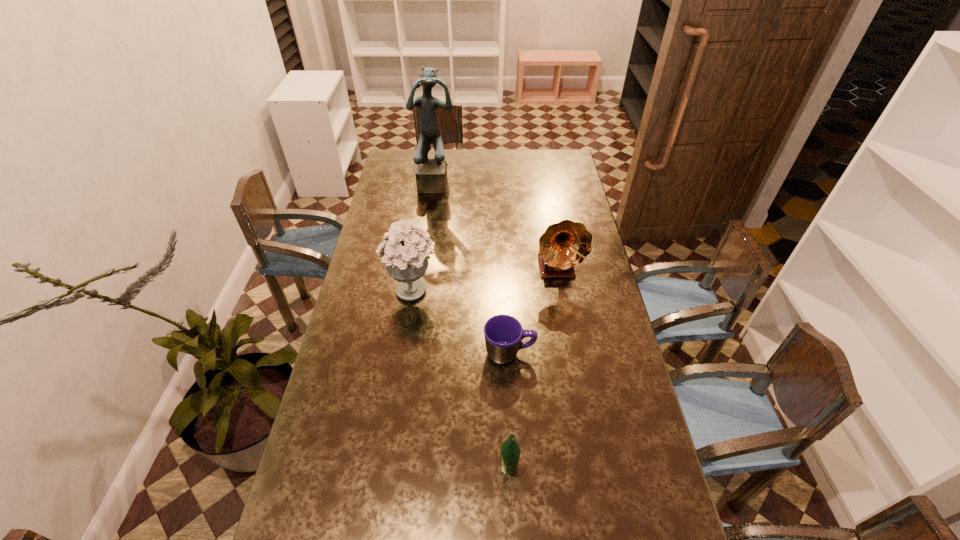
What are the coordinates of `sculpture` in the screenshot? It's located at [x=431, y=174].

The image size is (960, 540). What are the coordinates of `the farthest object` in the screenshot? It's located at (431, 174).

Where is `bouquet`? bouquet is located at coordinates (405, 254).

Image resolution: width=960 pixels, height=540 pixels. I want to click on phonograph_record, so click(x=566, y=244).

I want to click on the fourth tallest object, so click(x=510, y=450).

Where is `bottle`? bottle is located at coordinates (510, 450).

Where is `the shortest object`? The width and height of the screenshot is (960, 540). the shortest object is located at coordinates (503, 334).

Identify the location of the fourth farthest object. This screenshot has width=960, height=540. (503, 334).

I want to click on free space located 0.150m on the face of the farthest object, so click(433, 214).

Locate an element on the screen. free space located 0.080m on the right of the bouquet is located at coordinates (461, 289).